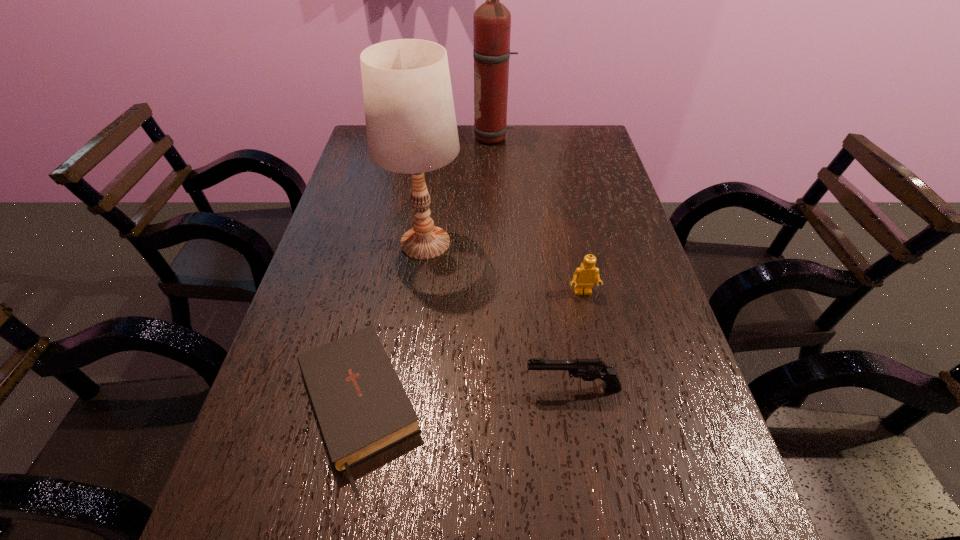
You are a GUI agent. You are given a task and a screenshot of the screen. Output one action in this format:
    pyautogui.click(x=<x>, y=<y>)
    Task: Click on the unoccupied position between the farthest object and the lamp
    This screenshot has width=960, height=540.
    Given the screenshot: What is the action you would take?
    pyautogui.click(x=460, y=190)

Locate an element on the screen. vacant area between the gun and the shortest object is located at coordinates (465, 399).

Locate an element on the screen. This screenshot has height=540, width=960. vacant point located between the gun and the third nearest object is located at coordinates (578, 340).

Identify which object is the third nearest to the Lego. Please provide its 2D coordinates. Your answer should be formatted as a tuple, i.e. [(x, y)], where the tuple contains the x and y coordinates of a point satisfying the conditions above.

[(361, 407)]

The width and height of the screenshot is (960, 540). I want to click on the fourth closest object relative to the gun, so (492, 20).